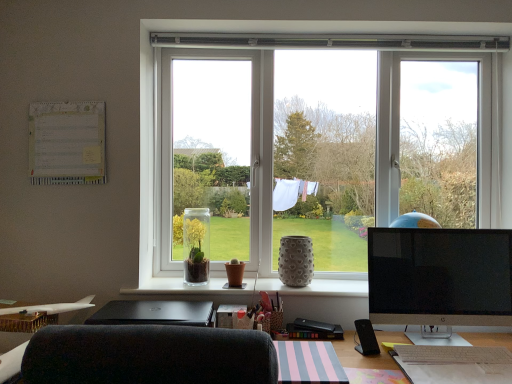
What are the coordinates of `blank space above white textured vase at center (from a real-world perspective)` in the screenshot? It's located at (252, 282).